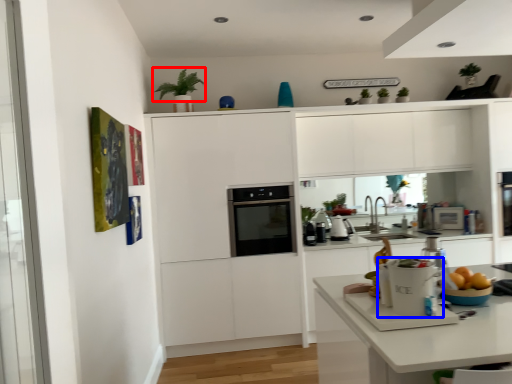
Question: Which object appears farthest to the camera in this image, plant (highlighted by a red box) or kitchen appliance (highlighted by a blue box)?

Choices:
 (A) plant
 (B) kitchen appliance

Answer: (A)